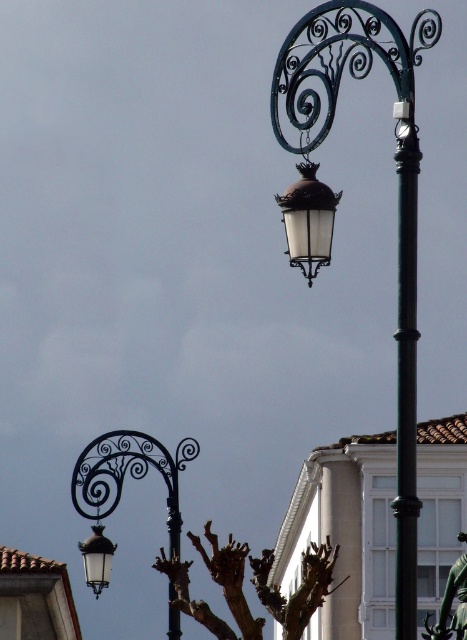
You are a delivery person trying to place a package on the ground near the bronze statue at center and the matte black lantern at lower left. Since you can only place it in front of one of them, which object should you choose to ensure the package is closer to the foreground tree?

The bronze statue at center is positioned over matte black lantern at lower left, so placing the package in front of the bronze statue at center would be closer to the foreground tree.

You are a photographer standing in front of the scene. You want to capture a photo where the black metal pole at upper right and the bronze statue at center are both visible. Based on their positions, which object should be placed on the left side of the photo frame?

The black metal pole at upper right is to the left of bronze statue at center, so the black metal pole at upper right should be placed on the left side of the photo frame.

You are an art curator planning to display the bronze statue at center and the matte black lantern at lower left in a gallery. Given their sizes, which object would require a larger base to remain stable?

The bronze statue at center requires a larger base because it is larger in size than the matte black lantern at lower left, necessitating a more substantial foundation for stability.